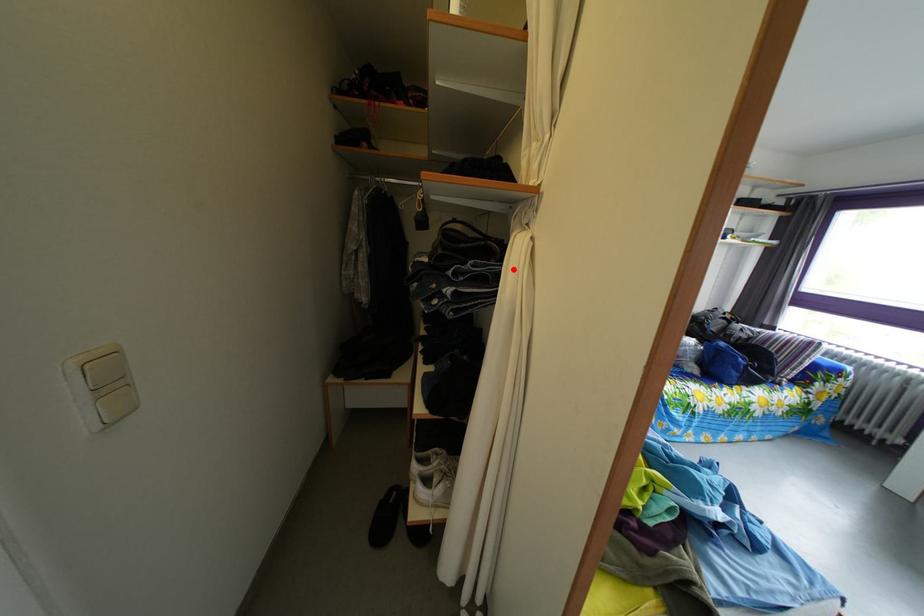
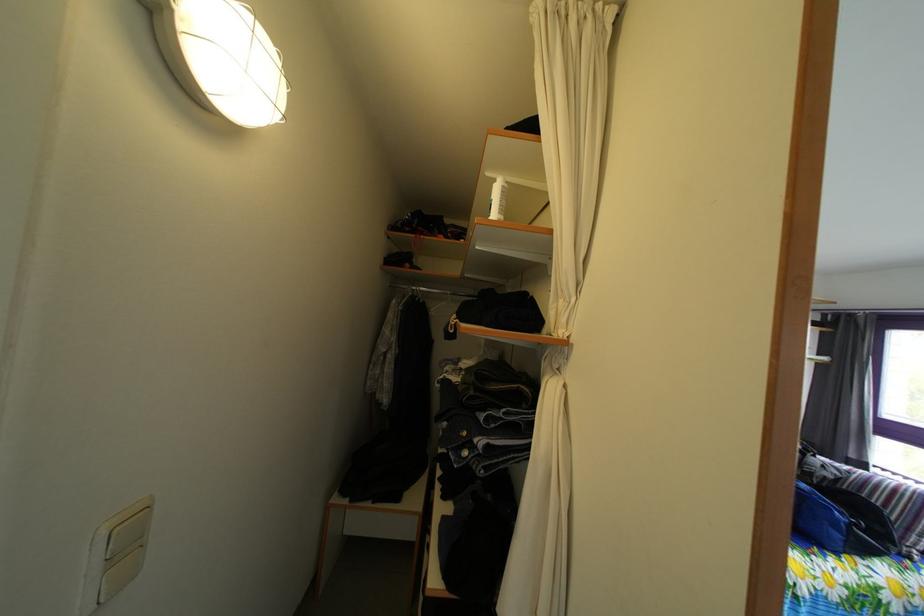
In the second image, find the point that corresponds to the highlighted location in the first image.

(545, 416)